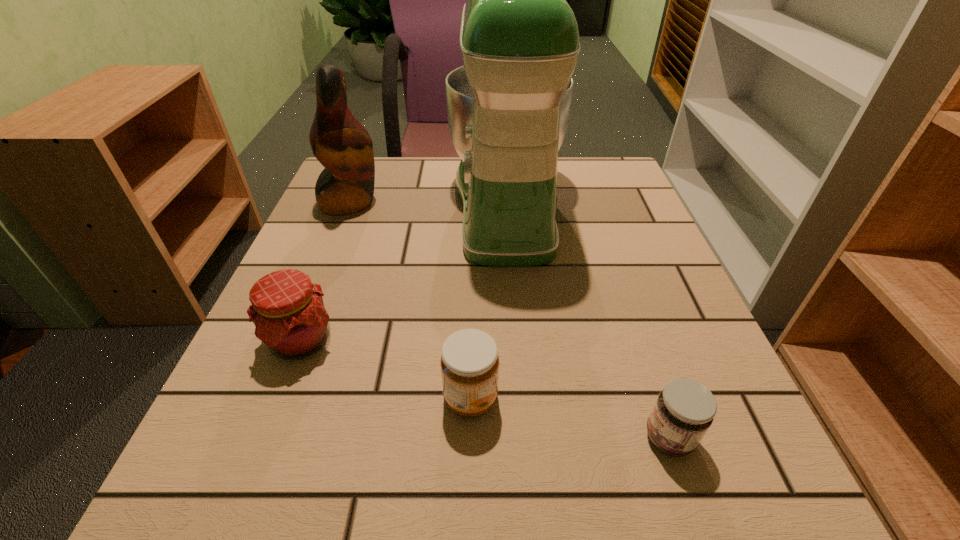
Where is `free spot between the leftmost jam and the second jam from left to right`? free spot between the leftmost jam and the second jam from left to right is located at coordinates (386, 369).

Image resolution: width=960 pixels, height=540 pixels. What are the coordinates of `vacant point located between the fourth shortest object and the second jam from left to right` in the screenshot? It's located at (410, 300).

The width and height of the screenshot is (960, 540). What are the coordinates of `free spot between the mixer and the rightmost object` in the screenshot? It's located at (x=588, y=321).

At what (x,y) coordinates should I click in order to perform the action: click on empty space that is in between the second jam from left to right and the tallest object. Please return your answer as a coordinate pair (x, y). The width and height of the screenshot is (960, 540). Looking at the image, I should click on (489, 301).

Where is `free area in between the third nearest object and the mixer`? The width and height of the screenshot is (960, 540). free area in between the third nearest object and the mixer is located at coordinates (404, 272).

Where is `vacant region between the second jam from left to right and the mixer`? The image size is (960, 540). vacant region between the second jam from left to right and the mixer is located at coordinates (489, 301).

In order to click on vacant space that's between the second jam from left to right and the fourth shortest object in this screenshot , I will do `click(410, 300)`.

Locate an element on the screen. The image size is (960, 540). vacant space that is in between the third nearest object and the second jam from right to left is located at coordinates tap(386, 369).

Identify the location of object that is the closest to the shortest object. The image size is (960, 540). (469, 362).

Point out which object is positioned as the fourth nearest to the shortest jam. Please provide its 2D coordinates. Your answer should be formatted as a tuple, i.e. [(x, y)], where the tuple contains the x and y coordinates of a point satisfying the conditions above.

[(339, 141)]